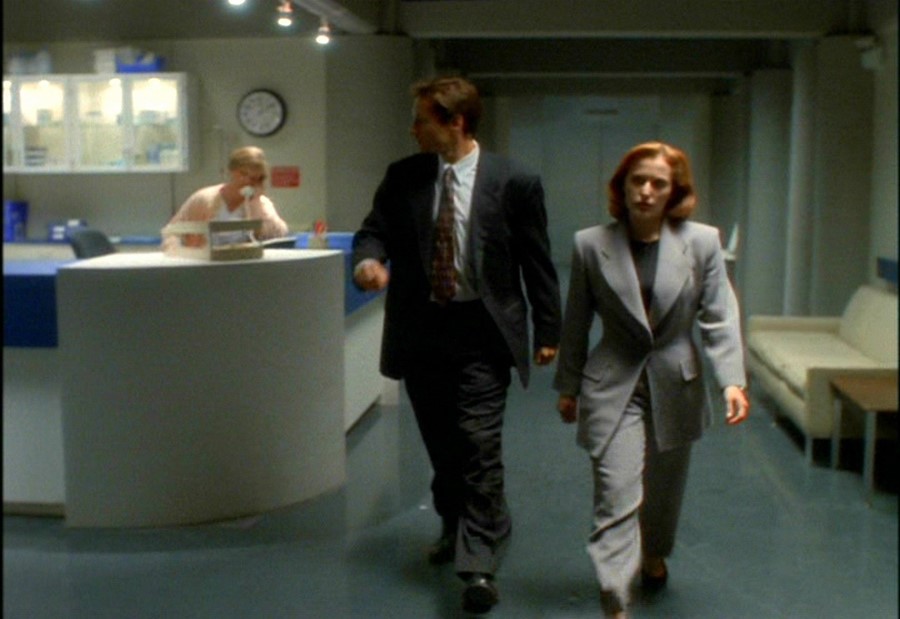
Find the location of a particular element. The height and width of the screenshot is (619, 900). clock is located at coordinates (258, 118).